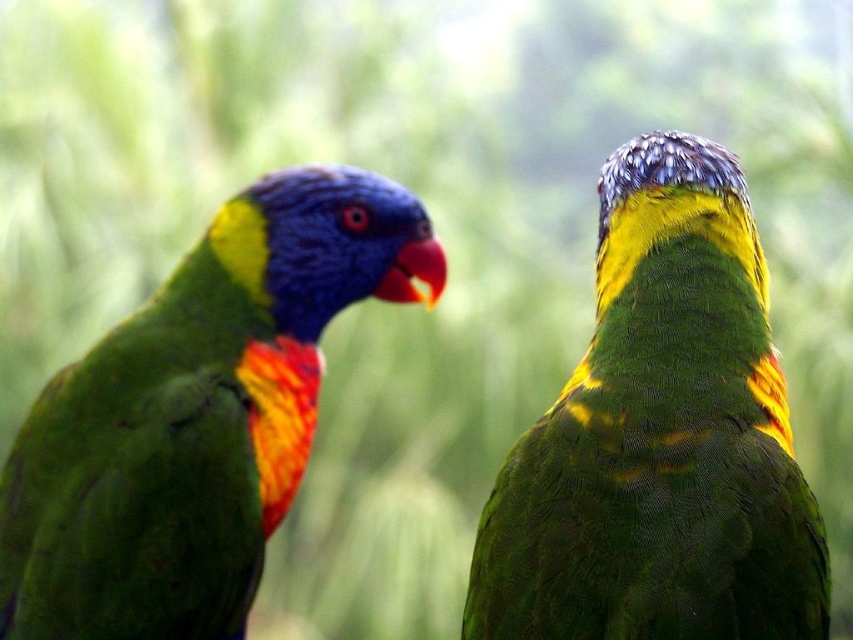
Question: Which point is closer to the camera?

Choices:
 (A) (225, 451)
 (B) (664, 611)

Answer: (B)

Question: Where is green matte parrot at upper right located in relation to shiny multicolored parrot at left in the image?

Choices:
 (A) above
 (B) below

Answer: (A)

Question: Is green matte parrot at upper right to the left of shiny multicolored parrot at left from the viewer's perspective?

Choices:
 (A) yes
 (B) no

Answer: (B)

Question: Which point appears farthest from the camera in this image?

Choices:
 (A) (631, 392)
 (B) (129, 532)

Answer: (B)

Question: Does green matte parrot at upper right have a greater width compared to shiny multicolored parrot at left?

Choices:
 (A) yes
 (B) no

Answer: (B)

Question: Which point is closer to the camera taking this photo?

Choices:
 (A) (558, 616)
 (B) (144, 592)

Answer: (A)